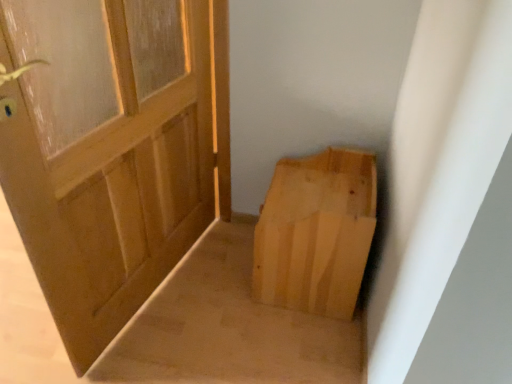
Describe the element at coordinates (316, 232) in the screenshot. I see `natural wood cardboard box at lower right` at that location.

You are a GUI agent. You are given a task and a screenshot of the screen. Output one action in this format:
    pyautogui.click(x=<x>, y=<y>)
    Task: Click on the natural wood cardboard box at lower right
    
    Given the screenshot: What is the action you would take?
    [316, 232]

Image resolution: width=512 pixels, height=384 pixels. What do you see at coordinates (113, 150) in the screenshot? I see `natural wood door at left` at bounding box center [113, 150].

Locate an element on the screen. This screenshot has width=512, height=384. natural wood door at left is located at coordinates (113, 150).

Where is `natural wood cardboard box at lower right`? natural wood cardboard box at lower right is located at coordinates (316, 232).

Between natural wood cardboard box at lower right and natural wood door at left, which one appears on the left side from the viewer's perspective?

From the viewer's perspective, natural wood door at left appears more on the left side.

Considering the positions of objects natural wood cardboard box at lower right and natural wood door at left in the image provided, who is in front, natural wood cardboard box at lower right or natural wood door at left?

natural wood door at left.

Does point (293, 189) come closer to viewer compared to point (62, 112)?

Yes, point (293, 189) is closer to viewer.

From the image's perspective, would you say natural wood cardboard box at lower right is shown under natural wood door at left?

Yes, from the image's perspective, natural wood cardboard box at lower right is below natural wood door at left.

From a real-world perspective, between natural wood cardboard box at lower right and natural wood door at left, who is vertically lower?

natural wood cardboard box at lower right, from a real-world perspective.

Between natural wood cardboard box at lower right and natural wood door at left, which one has larger width?

natural wood cardboard box at lower right is wider.

Is natural wood cardboard box at lower right taller or shorter than natural wood door at left?

In the image, natural wood cardboard box at lower right appears to be shorter than natural wood door at left.

Between natural wood cardboard box at lower right and natural wood door at left, which one has smaller size?

With smaller size is natural wood cardboard box at lower right.

Is natural wood door at left a part of natural wood cardboard box at lower right?

No.

Is there a large distance between natural wood cardboard box at lower right and natural wood door at left?

No, there isn't a large distance between natural wood cardboard box at lower right and natural wood door at left.

Is natural wood cardboard box at lower right positioned with its back to natural wood door at left?

No, natural wood cardboard box at lower right's orientation is not away from natural wood door at left.

Can you tell me how much natural wood cardboard box at lower right and natural wood door at left differ in facing direction?

13.9 degrees separate the facing orientations of natural wood cardboard box at lower right and natural wood door at left.

Identify the location of cardboard box below the natural wood door at left (from the image's perspective). The width and height of the screenshot is (512, 384). (316, 232).

Is natural wood door at left to the right of natural wood cardboard box at lower right from the viewer's perspective?

No.

Considering their positions, is natural wood door at left located in front of or behind natural wood cardboard box at lower right?

In the image, natural wood door at left appears in front of natural wood cardboard box at lower right.

Is point (68, 79) closer or farther from the camera than point (316, 170)?

Point (68, 79).

From the image's perspective, which is below, natural wood door at left or natural wood cardboard box at lower right?

natural wood cardboard box at lower right.

From a real-world perspective, who is located higher, natural wood door at left or natural wood cardboard box at lower right?

natural wood door at left is physically above.

In terms of width, does natural wood door at left look wider or thinner when compared to natural wood cardboard box at lower right?

Considering their sizes, natural wood door at left looks slimmer than natural wood cardboard box at lower right.

Does natural wood door at left have a greater height compared to natural wood cardboard box at lower right?

Yes, natural wood door at left is taller than natural wood cardboard box at lower right.

In terms of size, does natural wood door at left appear bigger or smaller than natural wood cardboard box at lower right?

natural wood door at left is bigger than natural wood cardboard box at lower right.

Is natural wood door at left positioned beyond the bounds of natural wood cardboard box at lower right?

Absolutely, natural wood door at left is external to natural wood cardboard box at lower right.

Is there a large distance between natural wood door at left and natural wood cardboard box at lower right?

A: They are positioned close to each other.

Could you tell me if natural wood door at left is turned towards natural wood cardboard box at lower right?

No, natural wood door at left is not aimed at natural wood cardboard box at lower right.

Can you tell me how much natural wood door at left and natural wood cardboard box at lower right differ in facing direction?

natural wood door at left and natural wood cardboard box at lower right are facing 13.9 degrees away from each other.

Where is `door in front of the natural wood cardboard box at lower right`? The width and height of the screenshot is (512, 384). door in front of the natural wood cardboard box at lower right is located at coordinates (113, 150).

Find the location of a particular element. Image resolution: width=512 pixels, height=384 pixels. door in front of the natural wood cardboard box at lower right is located at coordinates (113, 150).

Where is `cardboard box below the natural wood door at left (from the image's perspective)`? cardboard box below the natural wood door at left (from the image's perspective) is located at coordinates (316, 232).